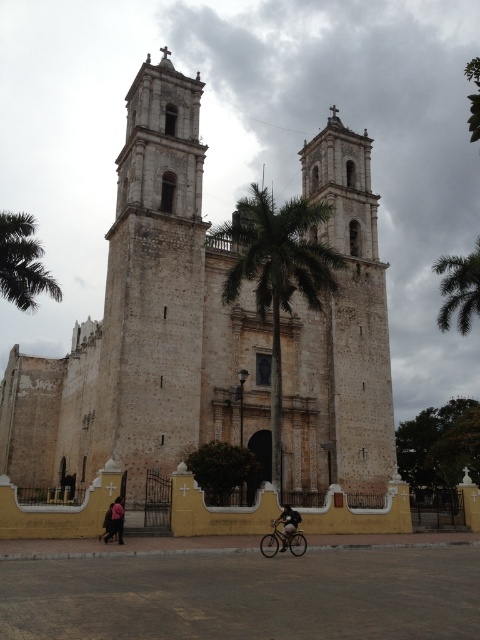
Question: Considering the real-world distances, which object is closest to the green leafy palm tree at center?

Choices:
 (A) shiny silver bicycle at lower center
 (B) green leafy palm tree at upper right
 (C) white stone bell tower at center

Answer: (C)

Question: Which point appears closest to the camera in this image?

Choices:
 (A) (111, 509)
 (B) (377, 408)
 (C) (354, 362)

Answer: (A)

Question: Is green leafy palm tree at left positioned at the back of green leafy palm tree at upper right?

Choices:
 (A) yes
 (B) no

Answer: (B)

Question: Where is white stone bell tower at center located in relation to dark pink fabric at lower left in the image?

Choices:
 (A) right
 (B) left

Answer: (A)

Question: Can you confirm if white stone cathedral at center is smaller than dark blue jeans at lower center?

Choices:
 (A) yes
 (B) no

Answer: (B)

Question: Which point is closer to the camera?

Choices:
 (A) shiny silver bicycle at lower center
 (B) dark blue jeans at lower center
 (C) white stone bell tower at center

Answer: (B)